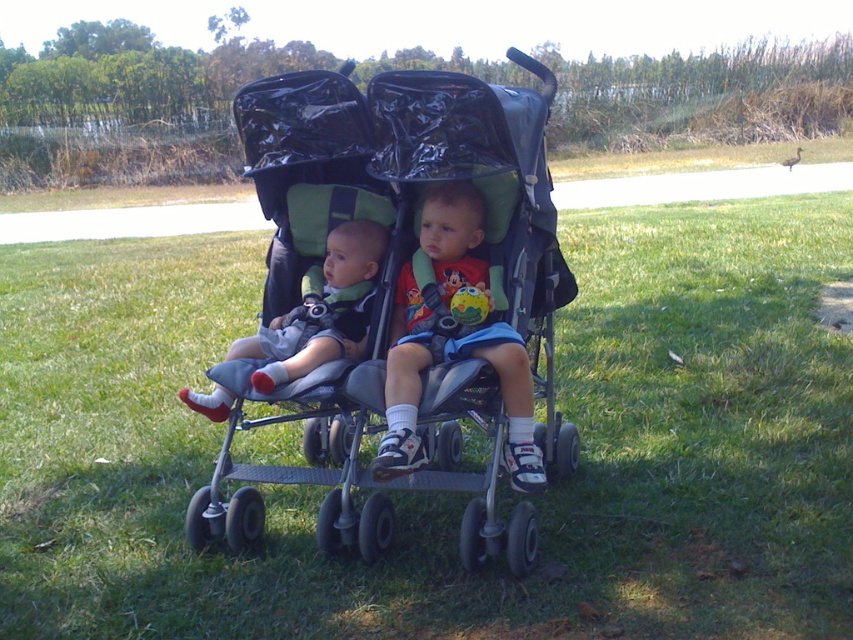
Is green grass at center taller than black plastic stroller at center?

No, green grass at center is not taller than black plastic stroller at center.

Is green grass at center closer to the viewer compared to black plastic stroller at center?

No, it is behind black plastic stroller at center.

You are a GUI agent. You are given a task and a screenshot of the screen. Output one action in this format:
    pyautogui.click(x=<x>, y=<y>)
    Task: Click on the green grass at center
    The height and width of the screenshot is (640, 853).
    Given the screenshot: What is the action you would take?
    pyautogui.click(x=450, y=493)

Is black plastic stroller at center thinner than matte gray stroller at left?

In fact, black plastic stroller at center might be wider than matte gray stroller at left.

Between point (485, 234) and point (251, 344), which one is positioned in front?

Point (485, 234)

Find the location of a particular element. black plastic stroller at center is located at coordinates (399, 296).

Looking at this image, is matte green cushion at center thinner than matte gray stroller at left?

Yes, matte green cushion at center is thinner than matte gray stroller at left.

Between matte green cushion at center and matte gray stroller at left, which one is positioned higher?

matte gray stroller at left is above.

Between point (427, 308) and point (355, 268), which one is positioned in front?

Point (427, 308) is in front.

This screenshot has height=640, width=853. Find the location of `matte green cushion at center`. matte green cushion at center is located at coordinates (403, 381).